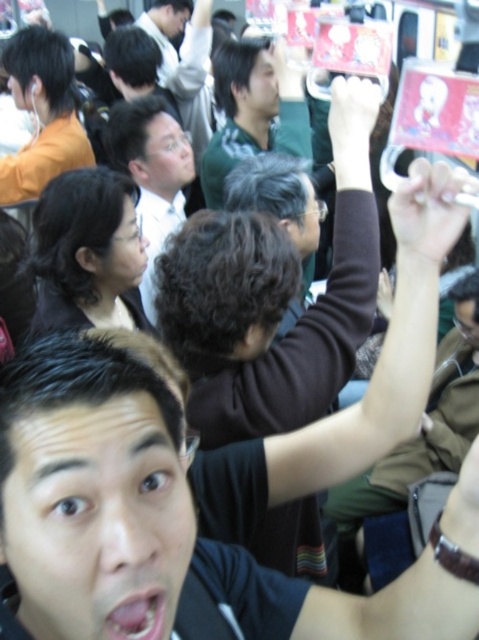
In the crowded indoor scene, you notice two people standing near each other. One is wearing a brown fuzzy sweater at upper center and the other has a matte black shirt at center. From your vantage point, which person is positioned to the right side?

The brown fuzzy sweater at upper center is to the right of the matte black shirt at center.

You are a photographer trying to capture a clear shot of the brown fuzzy sweater at upper center and the matte black shirt at center. Which of the two items will be more visible in your photo due to their height?

The brown fuzzy sweater at upper center is taller than the matte black shirt at center, so it will be more visible in the photo.

You are organizing a photo shoot and need to ensure that all participants are visible in the group photo. You notice two people in the crowd wearing a brown fuzzy sweater at upper center and a matte black shirt at center. Based on their clothing widths, which person might need to move closer to the front to ensure their entire outfit is captured in the photo?

The brown fuzzy sweater at upper center has a larger width than the matte black shirt at center, so the person wearing the brown fuzzy sweater at upper center may need to move closer to the front to ensure their entire outfit is captured in the photo.